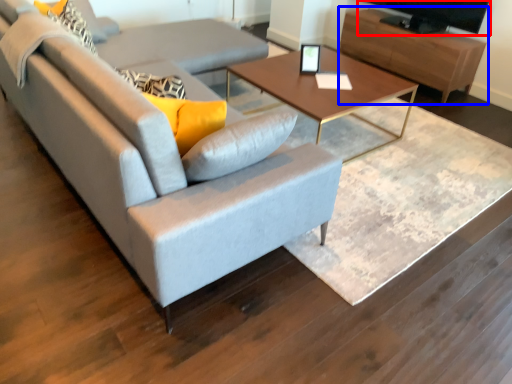
Question: Which point is closer to the camera, television (highlighted by a red box) or entertainment center (highlighted by a blue box)?

Choices:
 (A) television
 (B) entertainment center

Answer: (A)